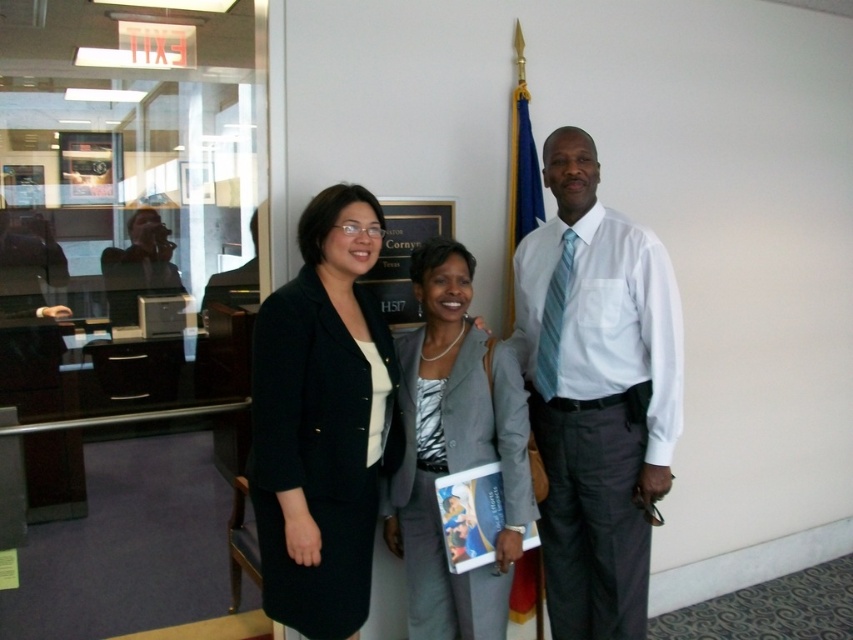
Question: Can you confirm if matte black blazer at center is smaller than white glossy shirt at center?

Choices:
 (A) no
 (B) yes

Answer: (A)

Question: Does white glossy shirt at center have a smaller size compared to matte black laptop at left?

Choices:
 (A) no
 (B) yes

Answer: (B)

Question: Is matte black blazer at center below matte black laptop at left?

Choices:
 (A) no
 (B) yes

Answer: (B)

Question: Based on their relative distances, which object is farther from the matte black blazer at center?

Choices:
 (A) gray fabric suit at center
 (B) white glossy shirt at center

Answer: (A)

Question: Based on their relative distances, which object is farther from the matte black blazer at center?

Choices:
 (A) gray fabric suit at center
 (B) black woolen blazer at center
 (C) matte black laptop at left

Answer: (C)

Question: Which point is farther to the camera?

Choices:
 (A) (599, 609)
 (B) (415, 342)

Answer: (A)